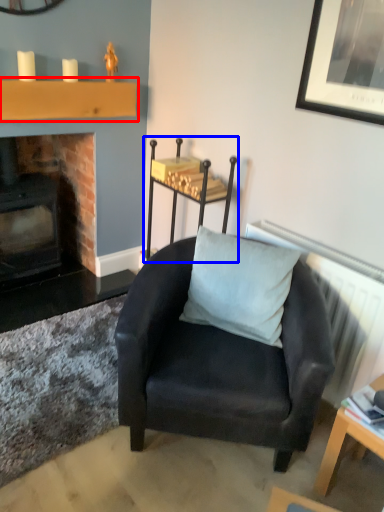
Question: Which object is further to the camera taking this photo, shelf (highlighted by a red box) or furniture (highlighted by a blue box)?

Choices:
 (A) shelf
 (B) furniture

Answer: (A)